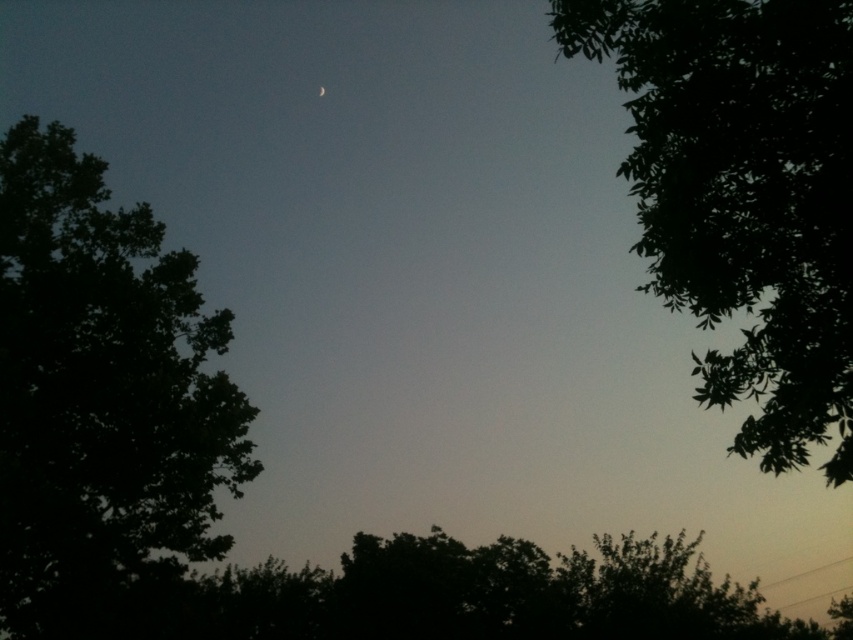
You are an ornithologist observing birds in the twilight scene. You notice two trees in the image. Which tree, the dark green leafy tree at left or the green leafy tree at upper right, is positioned higher in the sky?

The dark green leafy tree at left is positioned higher in the sky than the green leafy tree at upper right.

From the picture: You are an ornithologist observing birds in the twilight scene. You notice a bird flying from the dark green leafy tree at left to the green leafy tree at upper right. Based on the scene, which tree will the bird reach first?

The bird will reach the dark green leafy tree at left first because the green leafy tree at upper right is positioned behind it, meaning the dark green leafy tree at left is closer to the observer.